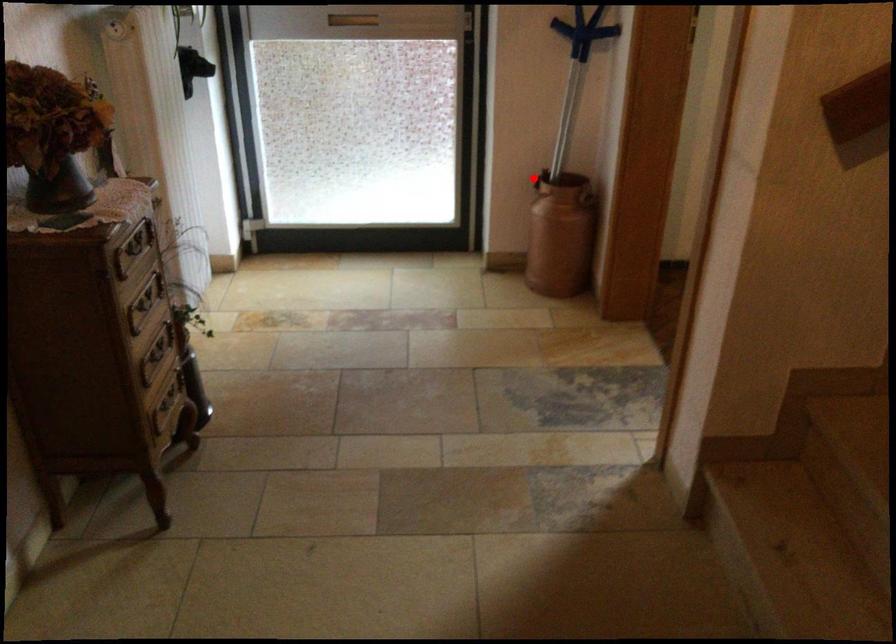
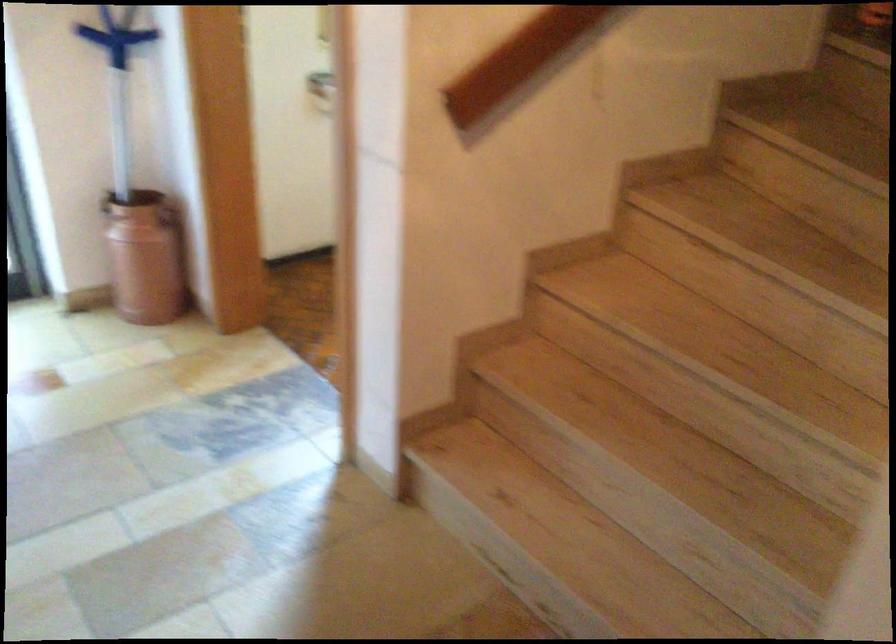
Question: I am providing you with two images of the same scene from different viewpoints. A red point is shown in image1. For the corresponding object point in image2, is it positioned nearer or farther from the camera?

Choices:
 (A) Nearer
 (B) Farther

Answer: (A)